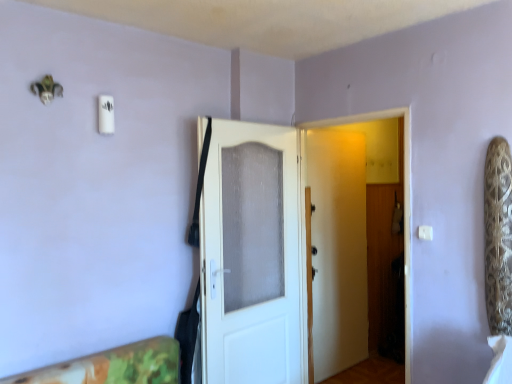
Question: In which direction should I rotate to look at white matte door at center, which appears as the second door when viewed from the left?

Choices:
 (A) right
 (B) left

Answer: (A)

Question: Can you see white plastic light switch at upper right touching white textured door at center, which ranks as the second door in right-to-left order?

Choices:
 (A) yes
 (B) no

Answer: (B)

Question: Could you tell me if white plastic light switch at upper right is facing white textured door at center, arranged as the first door when viewed from the left?

Choices:
 (A) yes
 (B) no

Answer: (B)

Question: Is white plastic light switch at upper right at the left side of white textured door at center, arranged as the first door when viewed from the left?

Choices:
 (A) yes
 (B) no

Answer: (B)

Question: Does white plastic light switch at upper right have a smaller size compared to white textured door at center, arranged as the first door when viewed from the left?

Choices:
 (A) yes
 (B) no

Answer: (A)

Question: Is white plastic light switch at upper right positioned in front of white textured door at center, arranged as the first door when viewed from the left?

Choices:
 (A) yes
 (B) no

Answer: (A)

Question: Can we say white plastic light switch at upper right lies outside white textured door at center, which ranks as the second door in right-to-left order?

Choices:
 (A) yes
 (B) no

Answer: (A)

Question: Is white textured door at center, arranged as the first door when viewed from the left, wider than white plastic light switch at upper right?

Choices:
 (A) no
 (B) yes

Answer: (B)

Question: Is white textured door at center, which ranks as the second door in right-to-left order, to the left of white plastic light switch at upper right from the viewer's perspective?

Choices:
 (A) no
 (B) yes

Answer: (B)

Question: Does white textured door at center, which ranks as the second door in right-to-left order, lie in front of white plastic light switch at upper right?

Choices:
 (A) no
 (B) yes

Answer: (A)

Question: Is white textured door at center, arranged as the first door when viewed from the left, not inside white plastic light switch at upper right?

Choices:
 (A) yes
 (B) no

Answer: (A)

Question: From the image's perspective, is white textured door at center, which ranks as the second door in right-to-left order, located above white plastic light switch at upper right?

Choices:
 (A) no
 (B) yes

Answer: (A)

Question: Considering the relative positions of white textured door at center, arranged as the first door when viewed from the left, and white plastic light switch at upper right in the image provided, is white textured door at center, arranged as the first door when viewed from the left, to the right of white plastic light switch at upper right from the viewer's perspective?

Choices:
 (A) no
 (B) yes

Answer: (A)

Question: Is there a large distance between white matte door at center, the 1th door when ordered from right to left, and white textured door at center, arranged as the first door when viewed from the left?

Choices:
 (A) no
 (B) yes

Answer: (A)